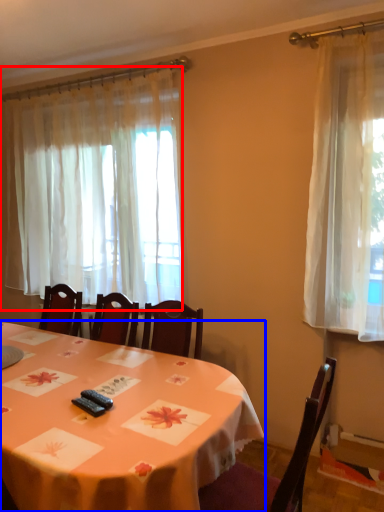
Question: Which point is further to the camera, curtain (highlighted by a red box) or table (highlighted by a blue box)?

Choices:
 (A) curtain
 (B) table

Answer: (A)